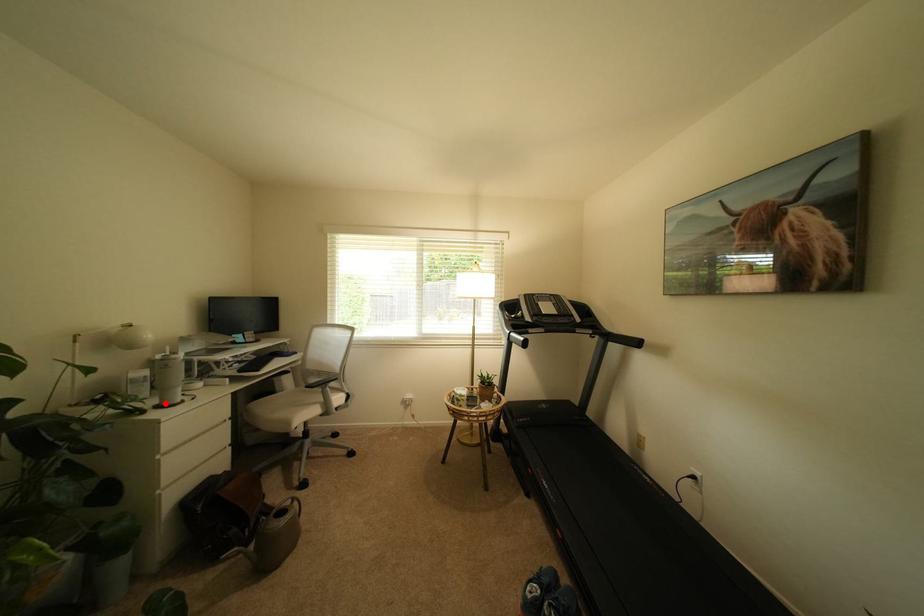
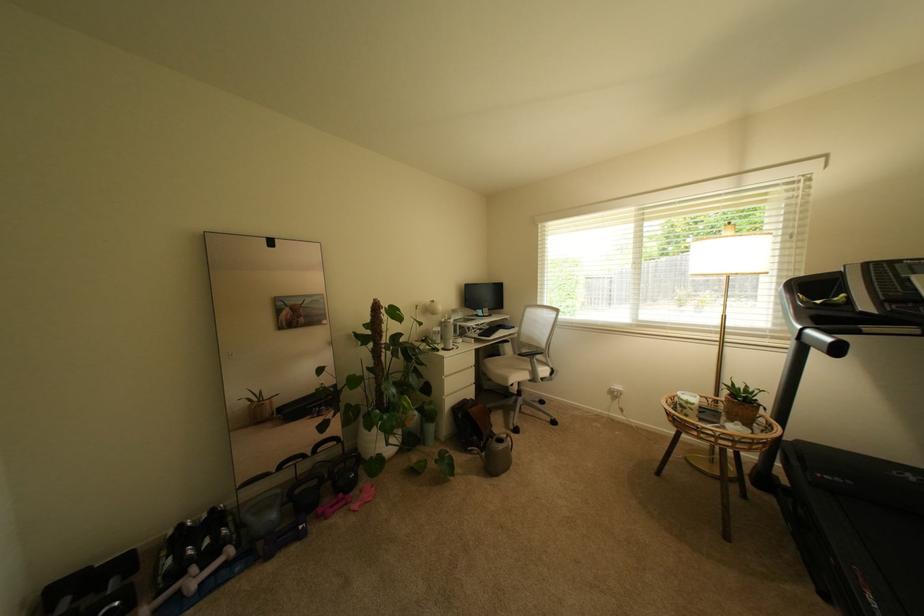
Locate, in the second image, the point that corresponds to the highlighted location in the first image.

(451, 347)